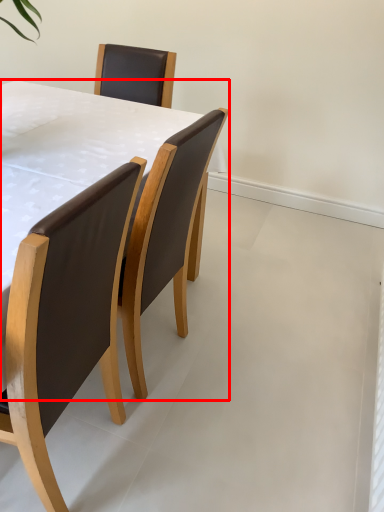
Question: From the image, what is the correct spatial relationship of table (annotated by the red box) in relation to chair?

Choices:
 (A) left
 (B) right

Answer: (B)